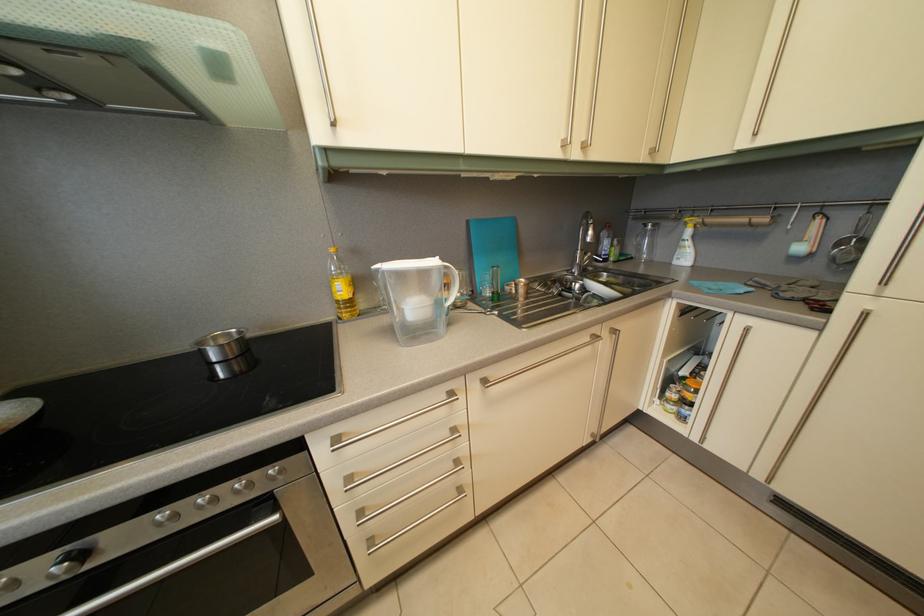
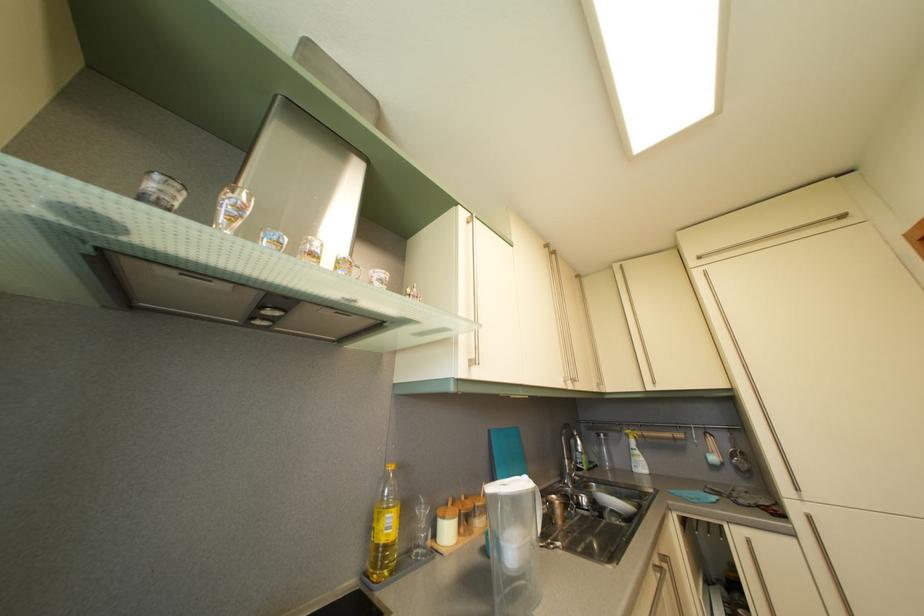
The point at (349, 297) is marked in the first image. Where is the corresponding point in the second image?

(396, 533)